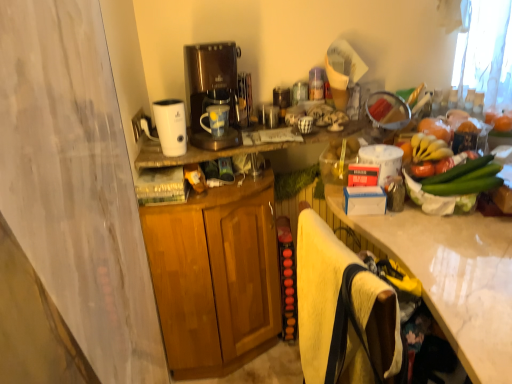
Question: Are wooden cabinet at center and white marble countertop at right beside each other?

Choices:
 (A) yes
 (B) no

Answer: (B)

Question: Is wooden cabinet at center not inside white marble countertop at right?

Choices:
 (A) no
 (B) yes

Answer: (B)

Question: From the image's perspective, is wooden cabinet at center beneath white marble countertop at right?

Choices:
 (A) yes
 (B) no

Answer: (B)

Question: Does wooden cabinet at center have a greater width compared to white marble countertop at right?

Choices:
 (A) no
 (B) yes

Answer: (A)

Question: From a real-world perspective, is wooden cabinet at center below white marble countertop at right?

Choices:
 (A) no
 (B) yes

Answer: (B)

Question: Would you say wooden cabinet at center is inside or outside yellow fuzzy beach towel at lower right?

Choices:
 (A) inside
 (B) outside

Answer: (B)

Question: Would you say wooden cabinet at center is to the left or to the right of yellow fuzzy beach towel at lower right in the picture?

Choices:
 (A) right
 (B) left

Answer: (B)

Question: From the image's perspective, is wooden cabinet at center positioned above or below yellow fuzzy beach towel at lower right?

Choices:
 (A) below
 (B) above

Answer: (A)

Question: Considering their positions, is wooden cabinet at center located in front of or behind yellow fuzzy beach towel at lower right?

Choices:
 (A) front
 (B) behind

Answer: (B)

Question: Is yellow matte bananas at upper right bigger or smaller than wooden cabinet at center?

Choices:
 (A) small
 (B) big

Answer: (A)

Question: Is yellow matte bananas at upper right situated inside wooden cabinet at center or outside?

Choices:
 (A) inside
 (B) outside

Answer: (B)

Question: Is yellow matte bananas at upper right taller or shorter than wooden cabinet at center?

Choices:
 (A) short
 (B) tall

Answer: (A)

Question: Is point (442, 137) positioned closer to the camera than point (209, 360)?

Choices:
 (A) closer
 (B) farther

Answer: (A)

Question: In terms of height, does yellow fuzzy beach towel at lower right look taller or shorter compared to white marble countertop at right?

Choices:
 (A) short
 (B) tall

Answer: (A)

Question: Is point (322, 246) closer or farther from the camera than point (507, 337)?

Choices:
 (A) farther
 (B) closer

Answer: (A)